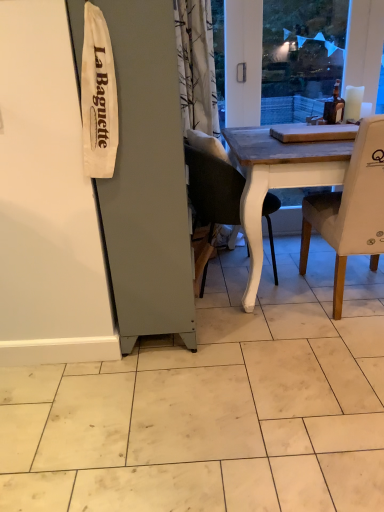
Question: Is point click(347, 205) positioned closer to the camera than point click(215, 184)?

Choices:
 (A) closer
 (B) farther

Answer: (A)

Question: In the image, is white fabric chair at right, acting as the first chair starting from the right, positioned in front of or behind matte black chair at center, arranged as the 1th chair when viewed from the left?

Choices:
 (A) behind
 (B) front

Answer: (B)

Question: Is white fabric chair at right, which ranks as the 2th chair in left-to-right order, spatially inside matte black chair at center, arranged as the 1th chair when viewed from the left, or outside of it?

Choices:
 (A) inside
 (B) outside

Answer: (B)

Question: Looking at their shapes, would you say matte black chair at center, which is the second chair from right to left, is wider or thinner than white fabric chair at right, which ranks as the 2th chair in left-to-right order?

Choices:
 (A) wide
 (B) thin

Answer: (B)

Question: From the image's perspective, is matte black chair at center, arranged as the 1th chair when viewed from the left, positioned above or below white fabric chair at right, acting as the first chair starting from the right?

Choices:
 (A) above
 (B) below

Answer: (A)

Question: Is point (190, 176) closer or farther from the camera than point (365, 147)?

Choices:
 (A) farther
 (B) closer

Answer: (A)

Question: Based on their sizes in the image, would you say matte black chair at center, arranged as the 1th chair when viewed from the left, is bigger or smaller than white fabric chair at right, acting as the first chair starting from the right?

Choices:
 (A) big
 (B) small

Answer: (B)